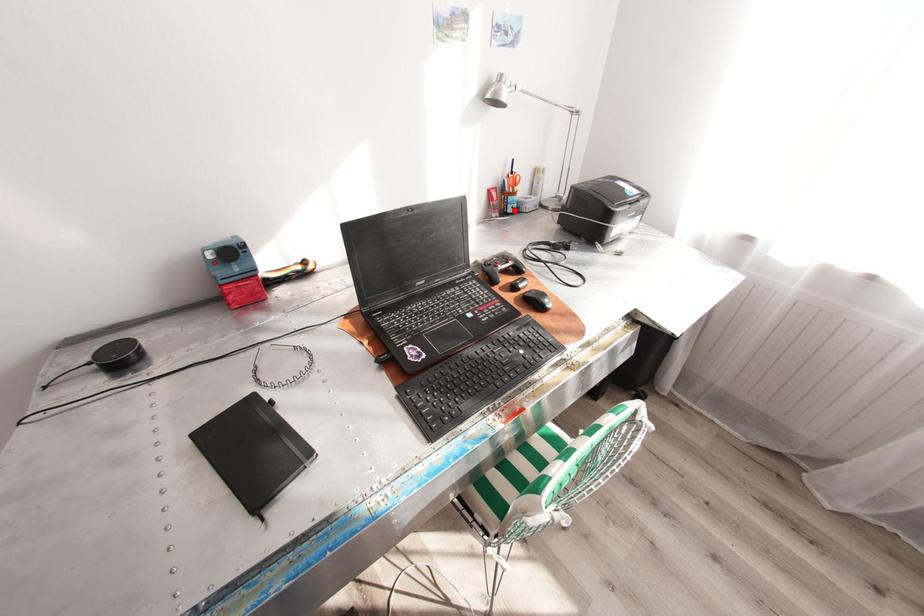
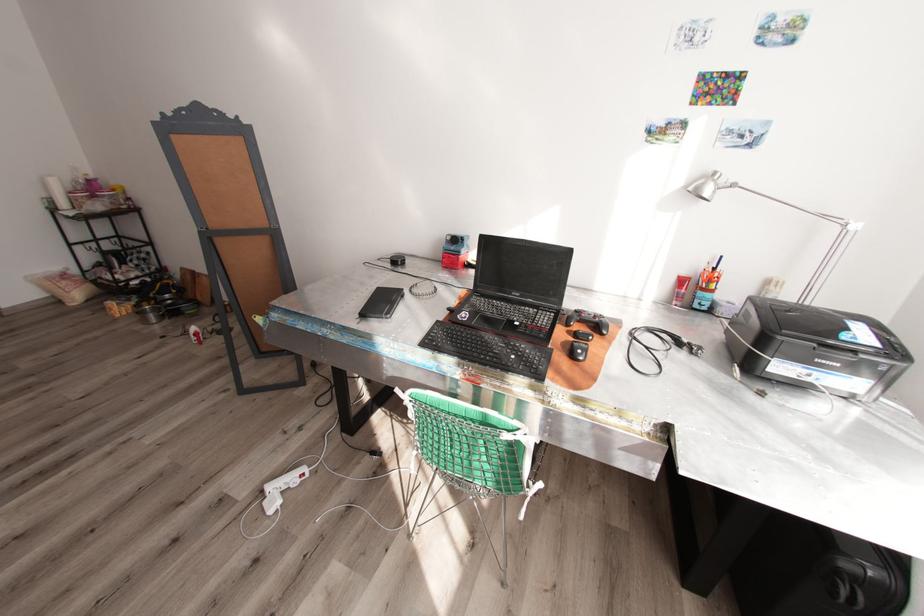
In the second image, find the point that corresponds to the highlighted location in the first image.

(699, 305)